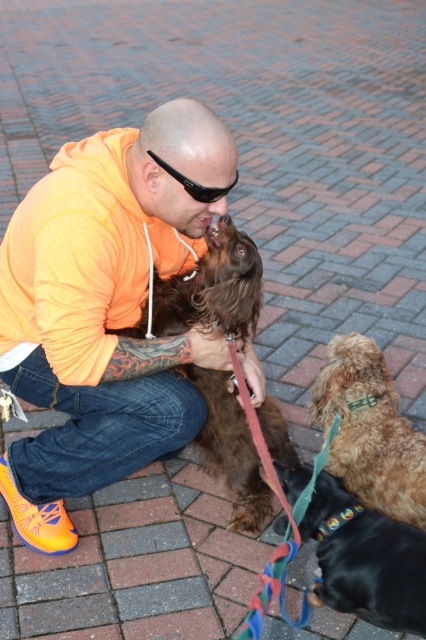
Does brown furry dog at center have a larger size compared to black plastic sunglasses at upper center?

Correct, brown furry dog at center is larger in size than black plastic sunglasses at upper center.

Does point (268, 497) come closer to viewer compared to point (210, 192)?

No, it is not.

The height and width of the screenshot is (640, 426). I want to click on brown furry dog at center, so (213, 288).

Does point (371, 392) come farther from viewer compared to point (334, 532)?

Yes, it is.

Who is more forward, (342, 477) or (322, 554)?

Point (322, 554) is more forward.

Is point (368, 483) positioned after point (305, 538)?

Yes, it is.

Locate an element on the screen. This screenshot has width=426, height=640. shiny brown fur at lower right is located at coordinates click(370, 429).

Is brown furry dog at center to the right of shiny brown fur at lower right from the viewer's perspective?

No, brown furry dog at center is not to the right of shiny brown fur at lower right.

Is point (176, 369) less distant than point (333, 380)?

No, (176, 369) is behind (333, 380).

Locate an element on the screen. brown furry dog at center is located at coordinates (213, 288).